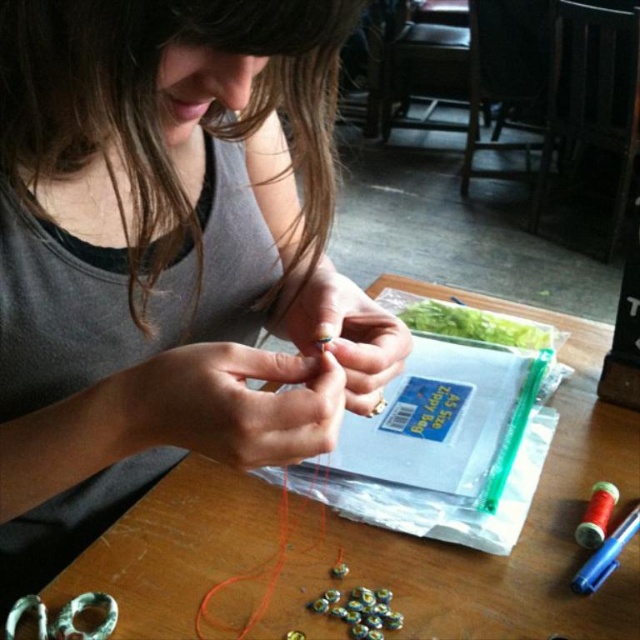
Does matte gray tank top at center have a lesser height compared to wooden table at center?

No, matte gray tank top at center is not shorter than wooden table at center.

Who is more distant from viewer, (204, 305) or (198, 611)?

Positioned behind is point (204, 305).

This screenshot has height=640, width=640. I want to click on matte gray tank top at center, so click(164, 256).

Find the location of a particular element. The height and width of the screenshot is (640, 640). matte gray tank top at center is located at coordinates (164, 256).